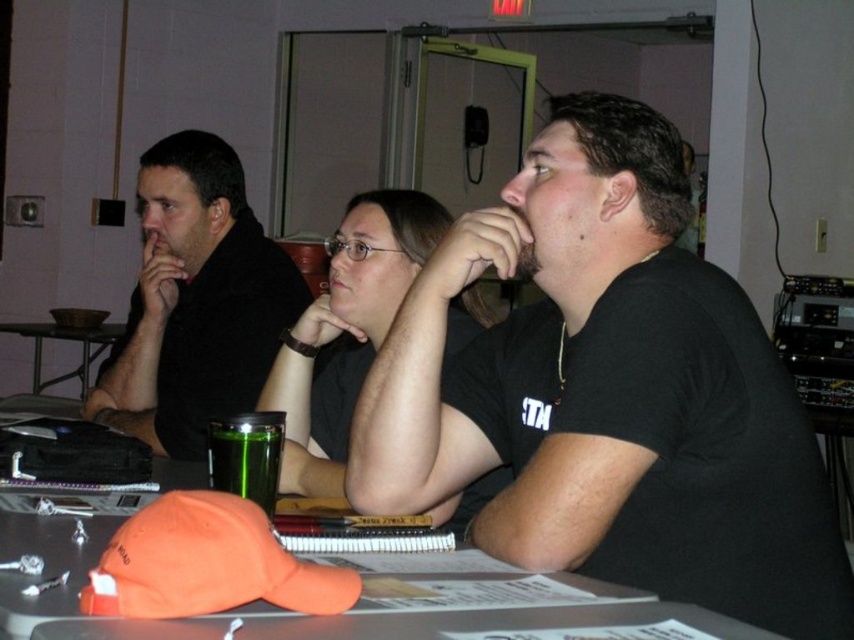
Question: Which object is farther from the camera taking this photo?

Choices:
 (A) orange fabric cap at center
 (B) black matte shirt at center
 (C) green glass at center
 (D) metallic dark gray table at left

Answer: (D)

Question: Does black matte shirt at center lie behind green glass at center?

Choices:
 (A) no
 (B) yes

Answer: (A)

Question: Which of the following is the closest to the observer?

Choices:
 (A) matte black shirt at left
 (B) metallic dark gray table at left
 (C) green glass at center
 (D) orange fabric cap at center

Answer: (D)

Question: Is orange fabric cap at center to the left of metallic dark gray table at left from the viewer's perspective?

Choices:
 (A) yes
 (B) no

Answer: (B)

Question: Which point appears farthest from the camera in this image?

Choices:
 (A) (167, 177)
 (B) (560, 369)

Answer: (A)

Question: Can you confirm if black matte shirt at center is positioned below matte black shirt at left?

Choices:
 (A) no
 (B) yes

Answer: (B)